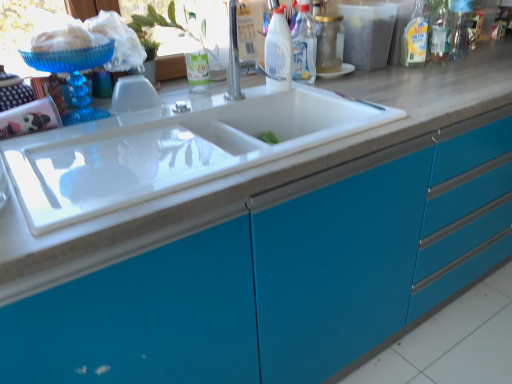
Locate an element on the screen. This screenshot has height=384, width=512. free space on the front side of clear plastic bottle at upper right, positioned as the first bottle in right-to-left order is located at coordinates (471, 66).